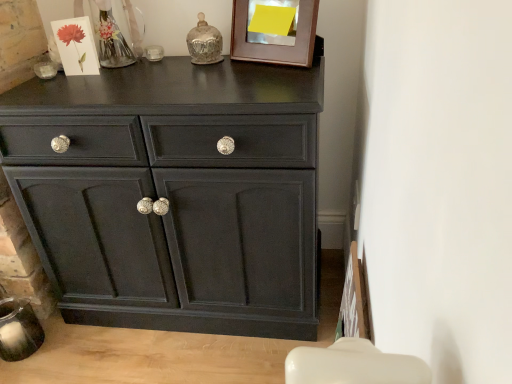
This screenshot has width=512, height=384. I want to click on free space to the left of wooden picture frame at upper center, so click(x=228, y=69).